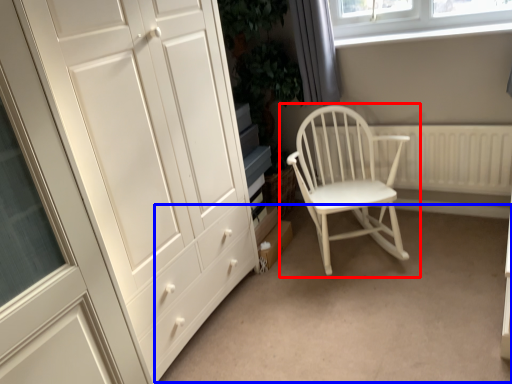
Question: Which object appears closest to the camera in this image, chair (highlighted by a red box) or plain (highlighted by a blue box)?

Choices:
 (A) chair
 (B) plain

Answer: (B)